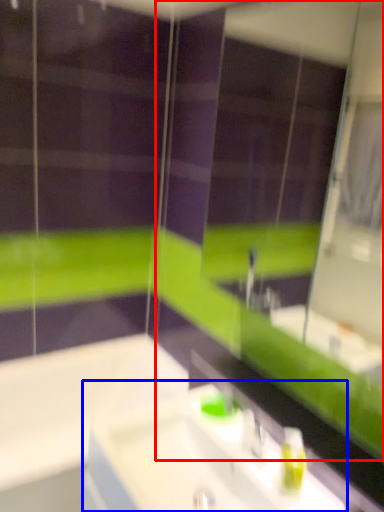
Question: Which object is further to the camera taking this photo, mirror (highlighted by a red box) or sink (highlighted by a blue box)?

Choices:
 (A) mirror
 (B) sink

Answer: (B)